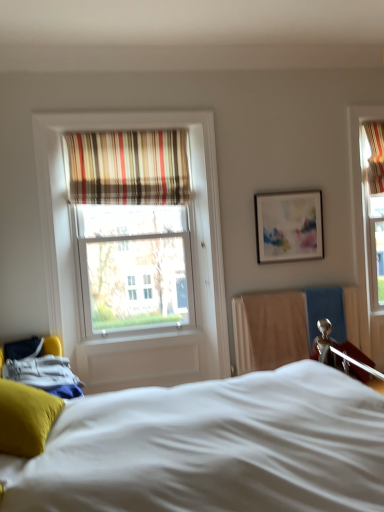
Question: Relative to white soft bed at center, is striped fabric curtain at upper center in front or behind?

Choices:
 (A) front
 (B) behind

Answer: (B)

Question: Choose the correct answer: Is striped fabric curtain at upper center inside white soft bed at center or outside it?

Choices:
 (A) outside
 (B) inside

Answer: (A)

Question: Which of these objects is positioned farthest from the white soft bed at center?

Choices:
 (A) striped fabric curtain at upper center
 (B) matte white picture frame at upper right
 (C) soft yellow pillow at lower left

Answer: (A)

Question: Which of these objects is positioned closest to the striped fabric curtain at upper center?

Choices:
 (A) soft yellow pillow at lower left
 (B) matte white picture frame at upper right
 (C) white soft bed at center

Answer: (B)